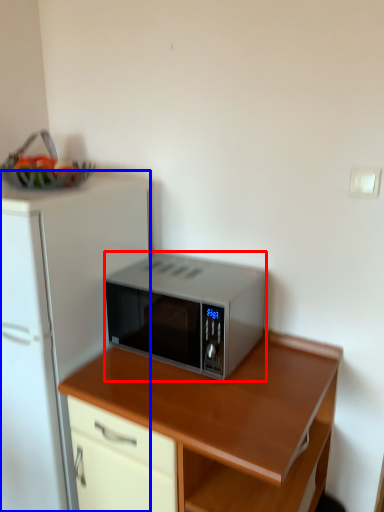
Question: Which object is further to the camera taking this photo, microwave oven (highlighted by a red box) or refrigerator (highlighted by a blue box)?

Choices:
 (A) microwave oven
 (B) refrigerator

Answer: (A)